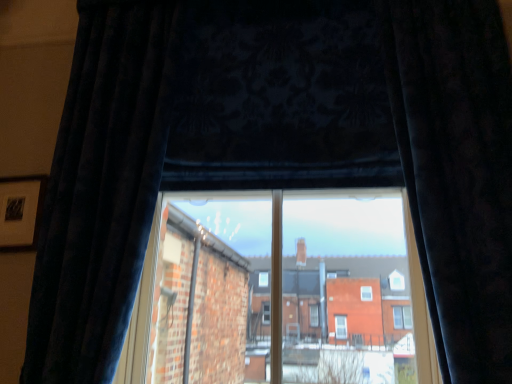
This screenshot has height=384, width=512. In order to click on velvet dark blue curtain at left, which is the second curtain in right-to-left order in this screenshot , I will do `click(101, 190)`.

The width and height of the screenshot is (512, 384). Describe the element at coordinates (101, 190) in the screenshot. I see `velvet dark blue curtain at left, which is the second curtain in right-to-left order` at that location.

How much space does velvet dark blue curtain at right, the second curtain when ordered from left to right, occupy vertically?

1.36 meters.

In order to click on velvet dark blue curtain at right, the first curtain in the right-to-left sequence in this screenshot , I will do `click(457, 172)`.

This screenshot has width=512, height=384. Describe the element at coordinates (457, 172) in the screenshot. I see `velvet dark blue curtain at right, the second curtain when ordered from left to right` at that location.

Where is `velvet dark blue curtain at left, the first curtain from the left`? Image resolution: width=512 pixels, height=384 pixels. velvet dark blue curtain at left, the first curtain from the left is located at coordinates (101, 190).

Between velvet dark blue curtain at right, the first curtain in the right-to-left sequence, and velvet dark blue curtain at left, the first curtain from the left, which one appears on the right side from the viewer's perspective?

Positioned to the right is velvet dark blue curtain at right, the first curtain in the right-to-left sequence.

Is the depth of velvet dark blue curtain at right, the second curtain when ordered from left to right, greater than that of velvet dark blue curtain at left, which is the second curtain in right-to-left order?

No, velvet dark blue curtain at right, the second curtain when ordered from left to right, is closer to the viewer.

Which point is more forward, [411,93] or [111,352]?

Positioned in front is point [111,352].

From the image's perspective, which one is positioned higher, velvet dark blue curtain at right, the second curtain when ordered from left to right, or velvet dark blue curtain at left, which is the second curtain in right-to-left order?

From the image's view, velvet dark blue curtain at right, the second curtain when ordered from left to right, is above.

From a real-world perspective, between velvet dark blue curtain at right, the first curtain in the right-to-left sequence, and velvet dark blue curtain at left, the first curtain from the left, who is vertically lower?

velvet dark blue curtain at right, the first curtain in the right-to-left sequence.

Considering the sizes of objects velvet dark blue curtain at right, the first curtain in the right-to-left sequence, and velvet dark blue curtain at left, the first curtain from the left, in the image provided, who is wider, velvet dark blue curtain at right, the first curtain in the right-to-left sequence, or velvet dark blue curtain at left, the first curtain from the left,?

velvet dark blue curtain at right, the first curtain in the right-to-left sequence, is wider.

Consider the image. In terms of height, does velvet dark blue curtain at right, the first curtain in the right-to-left sequence, look taller or shorter compared to velvet dark blue curtain at left, which is the second curtain in right-to-left order?

In the image, velvet dark blue curtain at right, the first curtain in the right-to-left sequence, appears to be shorter than velvet dark blue curtain at left, which is the second curtain in right-to-left order.

Is velvet dark blue curtain at right, the second curtain when ordered from left to right, bigger or smaller than velvet dark blue curtain at left, which is the second curtain in right-to-left order?

velvet dark blue curtain at right, the second curtain when ordered from left to right, is smaller than velvet dark blue curtain at left, which is the second curtain in right-to-left order.

Is velvet dark blue curtain at right, the second curtain when ordered from left to right, situated inside velvet dark blue curtain at left, the first curtain from the left, or outside?

velvet dark blue curtain at right, the second curtain when ordered from left to right, exists outside the volume of velvet dark blue curtain at left, the first curtain from the left.

Can you see velvet dark blue curtain at right, the second curtain when ordered from left to right, touching velvet dark blue curtain at left, which is the second curtain in right-to-left order?

There is a gap between velvet dark blue curtain at right, the second curtain when ordered from left to right, and velvet dark blue curtain at left, which is the second curtain in right-to-left order.

Does velvet dark blue curtain at right, the first curtain in the right-to-left sequence, turn towards velvet dark blue curtain at left, which is the second curtain in right-to-left order?

No, velvet dark blue curtain at right, the first curtain in the right-to-left sequence, is not aimed at velvet dark blue curtain at left, which is the second curtain in right-to-left order.

Locate an element on the screen. curtain directly beneath the velvet dark blue curtain at left, which is the second curtain in right-to-left order (from a real-world perspective) is located at coordinates (457, 172).

Which object is positioned more to the left, velvet dark blue curtain at left, the first curtain from the left, or velvet dark blue curtain at right, the second curtain when ordered from left to right?

velvet dark blue curtain at left, the first curtain from the left.

Considering their positions, is velvet dark blue curtain at left, the first curtain from the left, located in front of or behind velvet dark blue curtain at right, the second curtain when ordered from left to right?

In the image, velvet dark blue curtain at left, the first curtain from the left, appears behind velvet dark blue curtain at right, the second curtain when ordered from left to right.

Which is closer, (92, 142) or (440, 9)?

The point (92, 142) is closer.

Based on the photo, from the image's perspective, does velvet dark blue curtain at left, which is the second curtain in right-to-left order, appear lower than velvet dark blue curtain at right, the second curtain when ordered from left to right?

Indeed, from the image's perspective, velvet dark blue curtain at left, which is the second curtain in right-to-left order, is shown beneath velvet dark blue curtain at right, the second curtain when ordered from left to right.

From a real-world perspective, who is located higher, velvet dark blue curtain at left, the first curtain from the left, or velvet dark blue curtain at right, the second curtain when ordered from left to right?

In real-world perspective, velvet dark blue curtain at left, the first curtain from the left, is above.

Considering the relative sizes of velvet dark blue curtain at left, the first curtain from the left, and velvet dark blue curtain at right, the second curtain when ordered from left to right, in the image provided, is velvet dark blue curtain at left, the first curtain from the left, thinner than velvet dark blue curtain at right, the second curtain when ordered from left to right,?

Correct, the width of velvet dark blue curtain at left, the first curtain from the left, is less than that of velvet dark blue curtain at right, the second curtain when ordered from left to right.

Is velvet dark blue curtain at left, which is the second curtain in right-to-left order, taller than velvet dark blue curtain at right, the first curtain in the right-to-left sequence?

Yes, velvet dark blue curtain at left, which is the second curtain in right-to-left order, is taller than velvet dark blue curtain at right, the first curtain in the right-to-left sequence.

Can you confirm if velvet dark blue curtain at left, which is the second curtain in right-to-left order, is smaller than velvet dark blue curtain at right, the second curtain when ordered from left to right?

No, velvet dark blue curtain at left, which is the second curtain in right-to-left order, is not smaller than velvet dark blue curtain at right, the second curtain when ordered from left to right.

Is velvet dark blue curtain at left, which is the second curtain in right-to-left order, not within velvet dark blue curtain at right, the first curtain in the right-to-left sequence?

Yes, velvet dark blue curtain at left, which is the second curtain in right-to-left order, is located beyond the bounds of velvet dark blue curtain at right, the first curtain in the right-to-left sequence.

Is velvet dark blue curtain at left, which is the second curtain in right-to-left order, not near velvet dark blue curtain at right, the second curtain when ordered from left to right?

Indeed, velvet dark blue curtain at left, which is the second curtain in right-to-left order, is not near velvet dark blue curtain at right, the second curtain when ordered from left to right.

Is velvet dark blue curtain at left, the first curtain from the left, turned away from velvet dark blue curtain at right, the second curtain when ordered from left to right?

No, velvet dark blue curtain at left, the first curtain from the left,'s orientation is not away from velvet dark blue curtain at right, the second curtain when ordered from left to right.

How different are the orientations of velvet dark blue curtain at left, which is the second curtain in right-to-left order, and velvet dark blue curtain at right, the first curtain in the right-to-left sequence, in degrees?

0.405 degrees.

What are the coordinates of `curtain that appears above the velvet dark blue curtain at left, the first curtain from the left (from the image's perspective)` in the screenshot? It's located at (457, 172).

You are a GUI agent. You are given a task and a screenshot of the screen. Output one action in this format:
    pyautogui.click(x=<x>, y=<y>)
    Task: Click on the curtain located above the velvet dark blue curtain at right, the first curtain in the right-to-left sequence (from a real-world perspective)
    
    Given the screenshot: What is the action you would take?
    pyautogui.click(x=101, y=190)

At what (x,y) coordinates should I click in order to perform the action: click on curtain lying in front of the velvet dark blue curtain at left, which is the second curtain in right-to-left order. Please return your answer as a coordinate pair (x, y). This screenshot has width=512, height=384. Looking at the image, I should click on (457, 172).